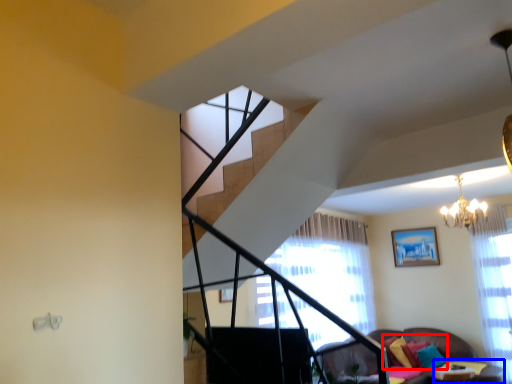
Question: Which point is closer to the camera, pillow (highlighted by a red box) or table (highlighted by a blue box)?

Choices:
 (A) pillow
 (B) table

Answer: (B)